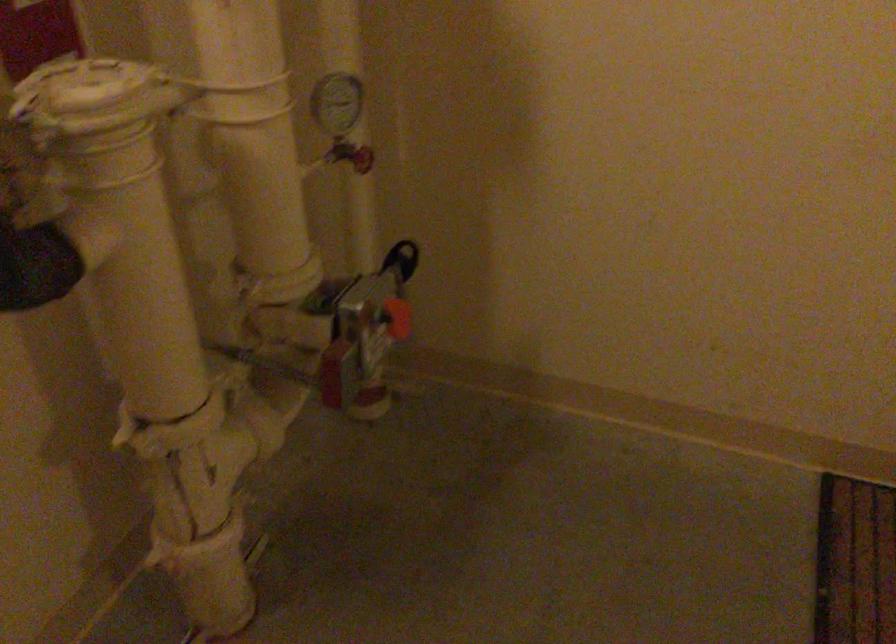
Locate an element on the screen. The image size is (896, 644). red valve handle is located at coordinates (x=366, y=335).